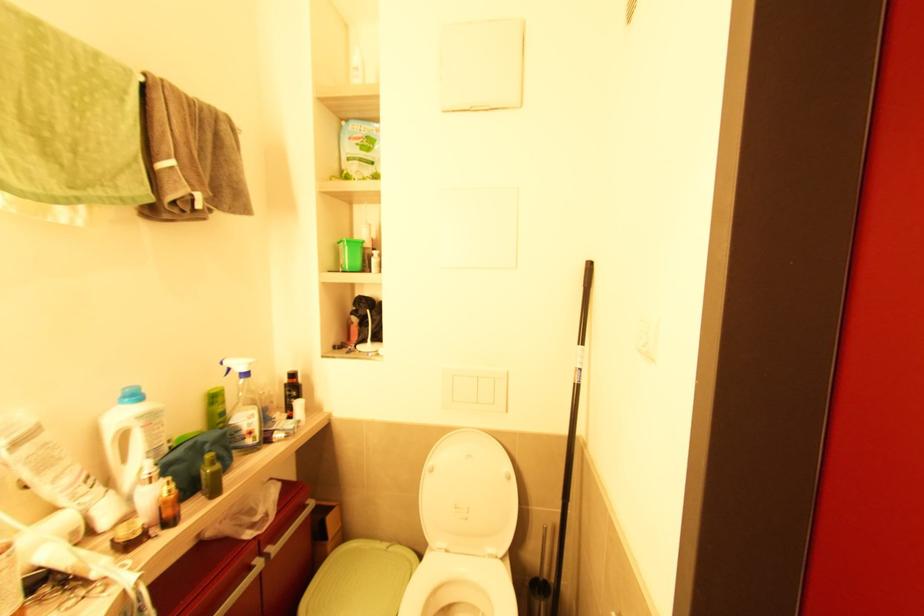
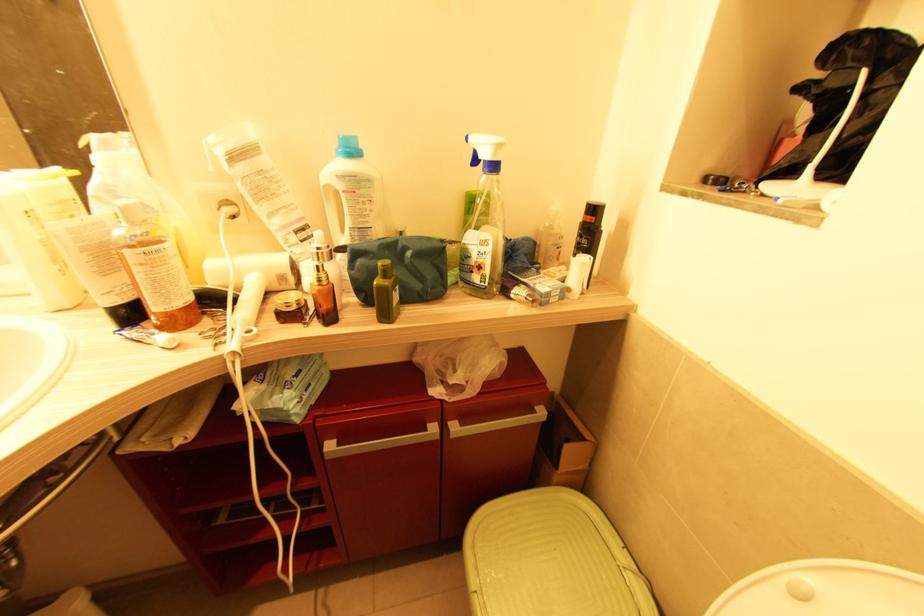
In the second image, find the point that corresponds to point 388,549 in the first image.

(626, 570)